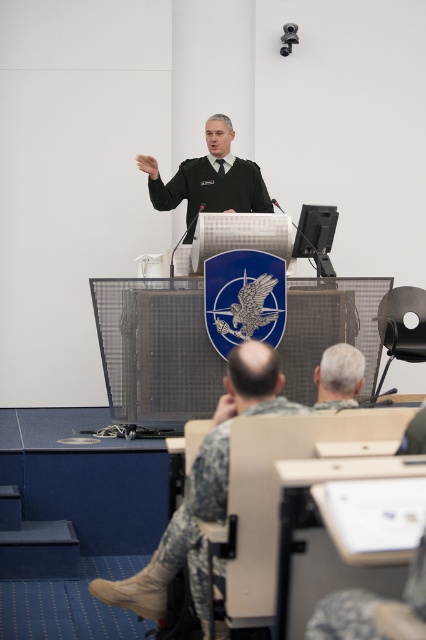
Can you confirm if camouflage fabric uniform at lower center is thinner than green uniform at center?

Yes.

Which is above, camouflage fabric uniform at lower center or green uniform at center?

green uniform at center is above.

You are a GUI agent. You are given a task and a screenshot of the screen. Output one action in this format:
    pyautogui.click(x=<x>, y=<y>)
    Task: Click on the camouflage fabric uniform at lower center
    This screenshot has height=640, width=426.
    Given the screenshot: What is the action you would take?
    pyautogui.click(x=198, y=513)

Is the position of camouflage fabric uniform at lower center more distant than that of gray matte hair at center?

That is False.

Is point (184, 522) closer to viewer compared to point (331, 349)?

That is True.

Between point (192, 522) and point (339, 355), which one is positioned in front?

Point (192, 522) is in front.

Identify the location of camouflage fabric uniform at lower center. (198, 513).

Does green uniform at center have a lesser width compared to gray matte hair at center?

In fact, green uniform at center might be wider than gray matte hair at center.

Describe the element at coordinates (212, 188) in the screenshot. The image size is (426, 640). I see `green uniform at center` at that location.

Identify the location of green uniform at center. (212, 188).